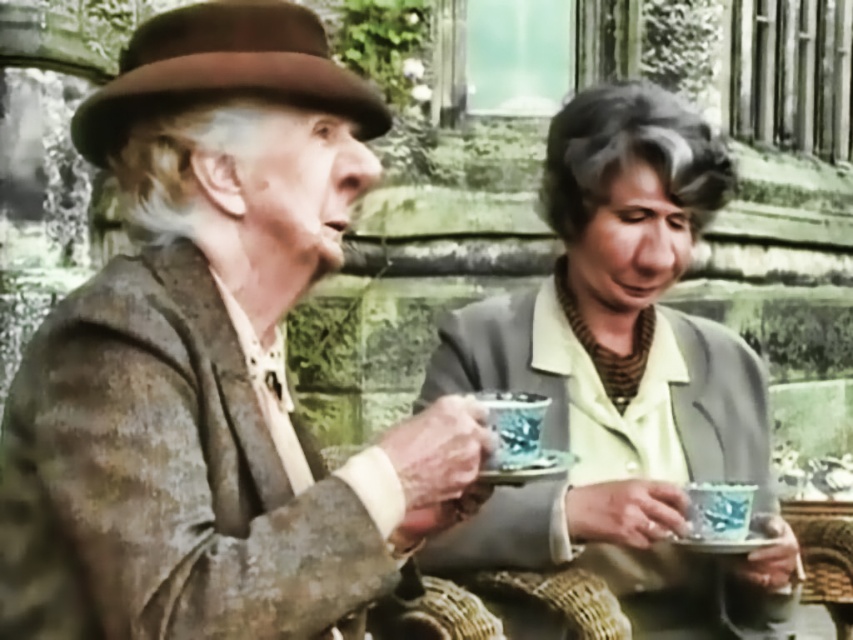
You are standing in front of the image and want to locate the distressed brown leather jacket at left. According to the coordinates provided, where is it positioned in the image?

The distressed brown leather jacket at left is positioned at the coordinates point (x=212, y=362) in the image.

You are standing in front of the two people having tea. Which of the two points, point (178, 608) or point (602, 128), is closer to you?

Point (178, 608) is closer to the viewer than point (602, 128).

Based on the photo, you are standing at the origin point of the image. A matte blue teacup at center is located at coordinates point (622,371). If you move 0.2 units to the right along the x axis, will you be closer to or farther from the matte blue teacup at center?

Moving 0.2 units to the right along the x axis from the origin point would take you to coordinates 0.2, 0.0. The distance between this new position and the matte blue teacup at center at point (622,371) can be calculated using the distance formula. The difference in the x coordinates is 0.581 minus 0.2 equals 0.381 units. The difference in the y coordinates is 0.730 minus 0.0 equals 0.730 units. Squaring both differences gives 0.145 and 0.533. Adding them together equals 0.678. Taking the square root of